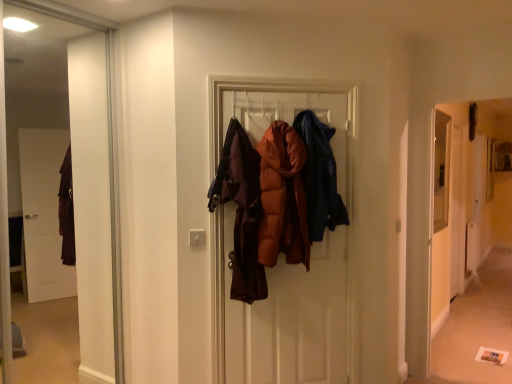
Question: Considering the relative sizes of carpeted floor at lower right and matte brown puffer jacket at center, positioned as the 2th garment in right-to-left order, in the image provided, is carpeted floor at lower right bigger than matte brown puffer jacket at center, positioned as the 2th garment in right-to-left order,?

Choices:
 (A) yes
 (B) no

Answer: (B)

Question: Considering the relative sizes of carpeted floor at lower right and matte brown puffer jacket at center, positioned as the 2th garment in right-to-left order, in the image provided, is carpeted floor at lower right taller than matte brown puffer jacket at center, positioned as the 2th garment in right-to-left order,?

Choices:
 (A) no
 (B) yes

Answer: (B)

Question: Does carpeted floor at lower right come behind matte brown puffer jacket at center, the 1th garment positioned from the left?

Choices:
 (A) no
 (B) yes

Answer: (B)

Question: From a real-world perspective, is carpeted floor at lower right positioned under matte brown puffer jacket at center, positioned as the 2th garment in right-to-left order, based on gravity?

Choices:
 (A) no
 (B) yes

Answer: (B)

Question: Considering the relative sizes of carpeted floor at lower right and matte brown puffer jacket at center, positioned as the 2th garment in right-to-left order, in the image provided, is carpeted floor at lower right thinner than matte brown puffer jacket at center, positioned as the 2th garment in right-to-left order,?

Choices:
 (A) yes
 (B) no

Answer: (A)

Question: Is carpeted floor at lower right outside matte brown puffer jacket at center, the 1th garment positioned from the left?

Choices:
 (A) yes
 (B) no

Answer: (A)

Question: Considering the relative sizes of carpeted floor at lower right and dark blue denim jacket at center, placed as the 2th garment when sorted from left to right, in the image provided, is carpeted floor at lower right shorter than dark blue denim jacket at center, placed as the 2th garment when sorted from left to right,?

Choices:
 (A) yes
 (B) no

Answer: (B)

Question: Can you confirm if carpeted floor at lower right is smaller than dark blue denim jacket at center, placed as the 2th garment when sorted from left to right?

Choices:
 (A) no
 (B) yes

Answer: (A)

Question: Does carpeted floor at lower right lie in front of dark blue denim jacket at center, the first garment when ordered from right to left?

Choices:
 (A) yes
 (B) no

Answer: (B)

Question: Is carpeted floor at lower right oriented towards dark blue denim jacket at center, the first garment when ordered from right to left?

Choices:
 (A) yes
 (B) no

Answer: (B)

Question: Considering the relative sizes of carpeted floor at lower right and dark blue denim jacket at center, placed as the 2th garment when sorted from left to right, in the image provided, is carpeted floor at lower right taller than dark blue denim jacket at center, placed as the 2th garment when sorted from left to right,?

Choices:
 (A) yes
 (B) no

Answer: (A)

Question: Can you confirm if carpeted floor at lower right is positioned to the right of dark blue denim jacket at center, the first garment when ordered from right to left?

Choices:
 (A) yes
 (B) no

Answer: (A)

Question: Can you confirm if carpeted floor at lower right is wider than transparent glass screen door at right?

Choices:
 (A) no
 (B) yes

Answer: (A)